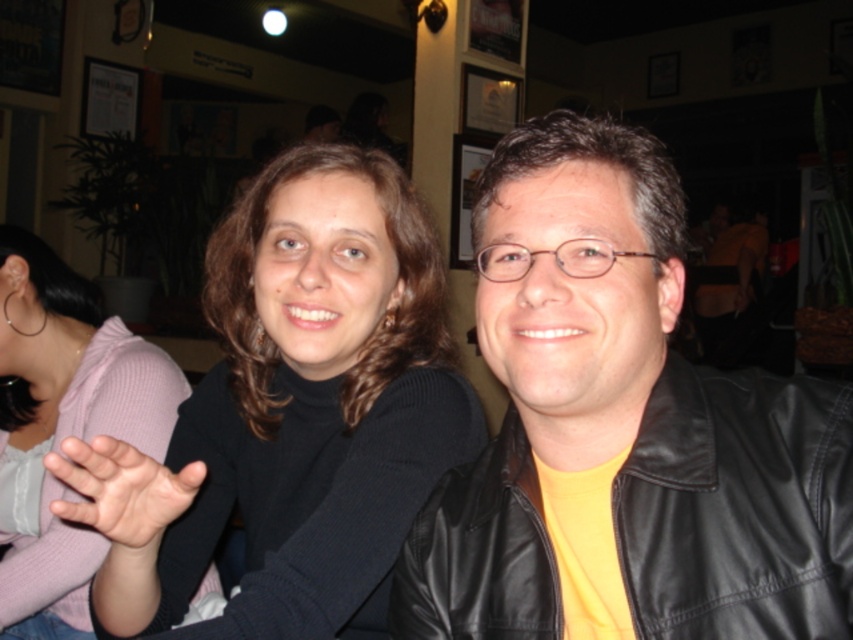
I want to click on black turtleneck sweater at center, so click(293, 413).

Can you confirm if black turtleneck sweater at center is thinner than matte black sweater at center?

In fact, black turtleneck sweater at center might be wider than matte black sweater at center.

This screenshot has width=853, height=640. I want to click on black turtleneck sweater at center, so click(x=293, y=413).

Is black turtleneck sweater at center positioned at the back of pink soft skin at center?

Yes, black turtleneck sweater at center is further from the viewer.

What do you see at coordinates (293, 413) in the screenshot?
I see `black turtleneck sweater at center` at bounding box center [293, 413].

Describe the element at coordinates (293, 413) in the screenshot. The image size is (853, 640). I see `black turtleneck sweater at center` at that location.

The width and height of the screenshot is (853, 640). In order to click on black turtleneck sweater at center in this screenshot , I will do `click(293, 413)`.

Is black leather jacket at right taller than matte black sweater at center?

In fact, black leather jacket at right may be shorter than matte black sweater at center.

Between black leather jacket at right and matte black sweater at center, which one has less height?

With less height is black leather jacket at right.

Measure the distance between black leather jacket at right and camera.

black leather jacket at right is 22.43 inches away from camera.

What are the coordinates of `black leather jacket at right` in the screenshot? It's located at (738, 506).